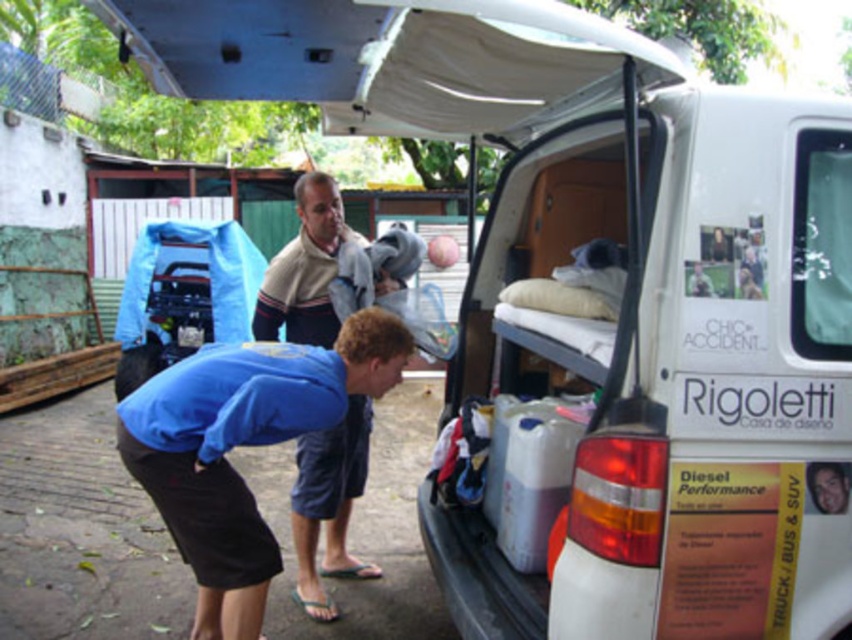
Question: Which object appears farthest from the camera in this image?

Choices:
 (A) beige striped sweater at center
 (B) blue fabric shirt at lower left

Answer: (A)

Question: Which of the following is the closest to the observer?

Choices:
 (A) beige striped sweater at center
 (B) blue fabric shirt at lower left

Answer: (B)

Question: Can you confirm if blue fabric shirt at lower left is positioned above beige striped sweater at center?

Choices:
 (A) yes
 (B) no

Answer: (A)

Question: Is blue fabric shirt at lower left bigger than beige striped sweater at center?

Choices:
 (A) no
 (B) yes

Answer: (B)

Question: Considering the relative positions of blue fabric shirt at lower left and beige striped sweater at center in the image provided, where is blue fabric shirt at lower left located with respect to beige striped sweater at center?

Choices:
 (A) right
 (B) left

Answer: (B)

Question: Which point is closer to the camera?

Choices:
 (A) [141, 410]
 (B) [337, 324]

Answer: (A)